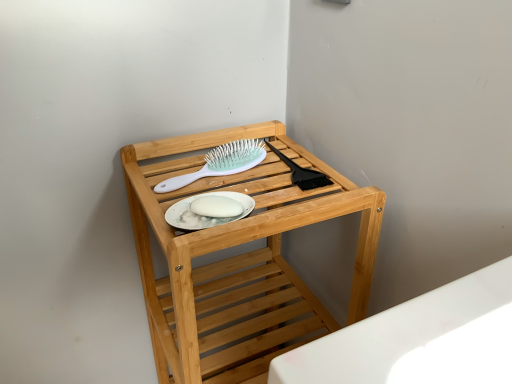
Question: From the image's perspective, is natural wood shelf at center positioned above or below white plastic hairbrush at upper center?

Choices:
 (A) below
 (B) above

Answer: (A)

Question: Based on their sizes in the image, would you say natural wood shelf at center is bigger or smaller than white plastic hairbrush at upper center?

Choices:
 (A) big
 (B) small

Answer: (A)

Question: Which object is positioned farthest from the white plastic hairbrush at upper center?

Choices:
 (A) natural wood shelf at center
 (B) white matte platter at center

Answer: (A)

Question: Which of these objects is positioned closest to the white plastic hairbrush at upper center?

Choices:
 (A) white matte platter at center
 (B) natural wood shelf at center

Answer: (A)